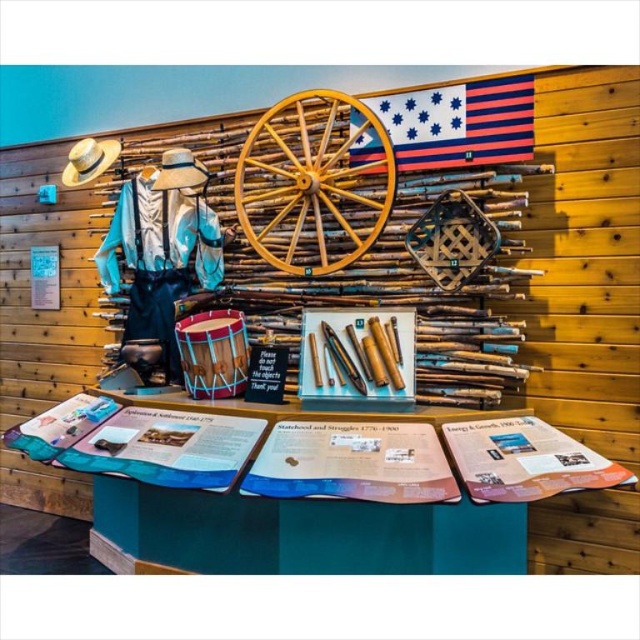
You are a museum visitor who wants to take a photo of both the striped fabric flag at upper center and the light brown straw cowboy hat at upper left in the same frame. Your camera has a maximum focus range of 1.2 meters. Can you capture both items in one photo without moving your position?

The striped fabric flag at upper center and the light brown straw cowboy hat at upper left are 1.30 meters apart. Since your camera can only focus within 1.2 meters, you cannot capture both items in the same frame without moving closer or adjusting your position to reduce the distance between them.

You are a visitor at the exhibit and want to take a photo of the striped fabric flag at upper center. The museum requires that all photos must include the decorative wagon wheel on the wall in the background. Is the flag positioned in a way that allows both the flag and the wagon wheel to be in the same frame?

The striped fabric flag at upper center is located at point (460,124), which is above the decorative wagon wheel. Since the flag is positioned above the wagon wheel, they can both be included in the same frame by adjusting the camera angle to capture both elements.

You are a visitor at the exhibit and want to know if the blue denim jacket at left is positioned above or below the striped fabric flag at upper center. Based on the exhibit layout, what is the correct spatial relationship between these two items?

The blue denim jacket at left is below the striped fabric flag at upper center according to the exhibit layout.